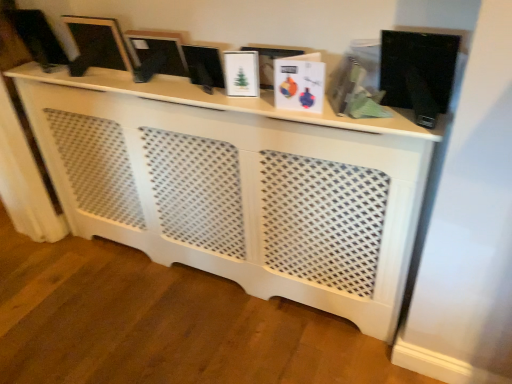
Locate an element on the screen. This screenshot has width=512, height=384. free space underneath matte black monitor at upper left, which is the 1th computer monitor in left-to-right order (from a real-world perspective) is located at coordinates (45, 66).